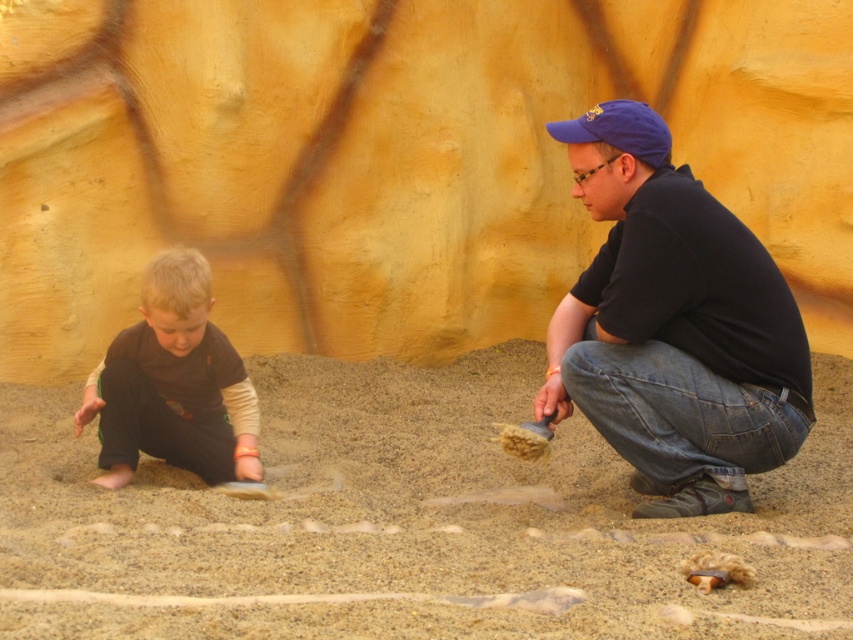
Who is more distant from viewer, (x=672, y=348) or (x=146, y=422)?

The point (x=146, y=422) is behind.

Between dark blue cotton shirt at right and dark brown fabric pants at lower left, which one has less height?

Standing shorter between the two is dark brown fabric pants at lower left.

Is point (737, 298) positioned before point (187, 410)?

Yes, it is in front of point (187, 410).

This screenshot has width=853, height=640. I want to click on dark blue cotton shirt at right, so click(x=672, y=324).

Between dark blue cotton shirt at right and blue fabric baseball cap at upper right, which one is positioned higher?

blue fabric baseball cap at upper right is higher up.

Between point (643, 224) and point (589, 113), which one is positioned behind?

Positioned behind is point (589, 113).

Is point (635, 310) positioned before point (624, 138)?

Yes, point (635, 310) is in front of point (624, 138).

This screenshot has height=640, width=853. I want to click on dark blue cotton shirt at right, so click(672, 324).

Consider the image. Can you confirm if dark brown fabric pants at lower left is positioned above blue fabric baseball cap at upper right?

No.

Is dark brown fabric pants at lower left taller than blue fabric baseball cap at upper right?

Indeed, dark brown fabric pants at lower left has a greater height compared to blue fabric baseball cap at upper right.

Locate an element on the screen. The height and width of the screenshot is (640, 853). dark brown fabric pants at lower left is located at coordinates (173, 385).